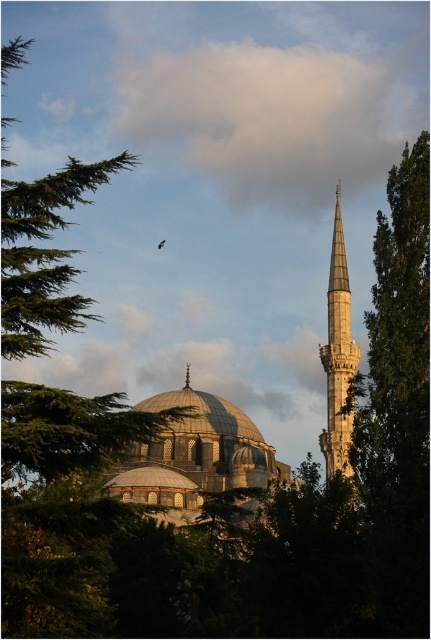
Question: Which point appears closest to the camera in this image?

Choices:
 (A) (187, 374)
 (B) (27, 316)
 (C) (159, 244)
 (D) (343, 317)

Answer: (B)

Question: Is gray stone dome at center to the right of silver metallic spire at center from the viewer's perspective?

Choices:
 (A) no
 (B) yes

Answer: (B)

Question: Is white fluffy cloud at upper center to the left of silver metallic spire at center from the viewer's perspective?

Choices:
 (A) yes
 (B) no

Answer: (B)

Question: Which of the following is the closest to the observer?

Choices:
 (A) white marble minaret at center
 (B) brown feathered bird at upper center
 (C) white fluffy cloud at upper center
 (D) silver metallic spire at center

Answer: (A)

Question: Which point is closer to the camera?

Choices:
 (A) white marble minaret at center
 (B) green needle-like tree at upper left

Answer: (B)

Question: Is silver metallic spire at center wider than brown feathered bird at upper center?

Choices:
 (A) yes
 (B) no

Answer: (B)